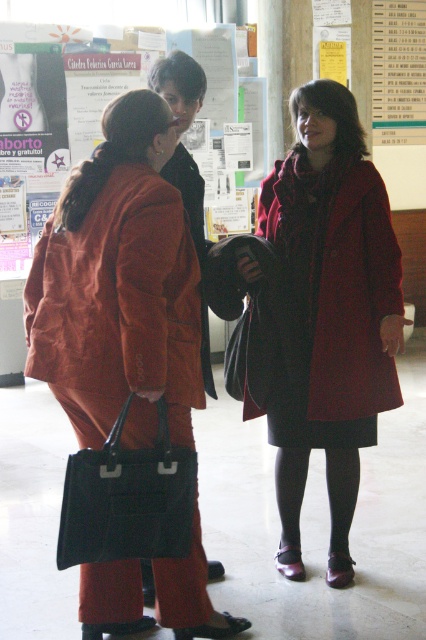
Between matte red coat at center and white paper at upper right, which one appears on the right side from the viewer's perspective?

Positioned to the right is white paper at upper right.

Is matte red coat at center smaller than white paper at upper right?

Yes.

Describe the element at coordinates (356, 304) in the screenshot. The image size is (426, 640). I see `matte red coat at center` at that location.

Locate an element on the screen. The image size is (426, 640). matte red coat at center is located at coordinates (356, 304).

Can you confirm if matte orange coat at left is positioned to the left of matte black poster at upper center?

In fact, matte orange coat at left is to the right of matte black poster at upper center.

Does matte orange coat at left have a lesser height compared to matte black poster at upper center?

Indeed, matte orange coat at left has a lesser height compared to matte black poster at upper center.

Find the location of a particular element. matte orange coat at left is located at coordinates (118, 296).

You are a GUI agent. You are given a task and a screenshot of the screen. Output one action in this format:
    pyautogui.click(x=<x>, y=<y>)
    Task: Click on the matte orange coat at left
    The image size is (426, 640).
    Given the screenshot: What is the action you would take?
    [118, 296]

Can you confirm if matte black poster at upper center is smaller than white paper at upper right?

No, matte black poster at upper center is not smaller than white paper at upper right.

Does matte black poster at upper center appear on the right side of white paper at upper right?

In fact, matte black poster at upper center is to the left of white paper at upper right.

The width and height of the screenshot is (426, 640). What do you see at coordinates (114, 97) in the screenshot?
I see `matte black poster at upper center` at bounding box center [114, 97].

This screenshot has width=426, height=640. What are the coordinates of `matte black poster at upper center` in the screenshot? It's located at (114, 97).